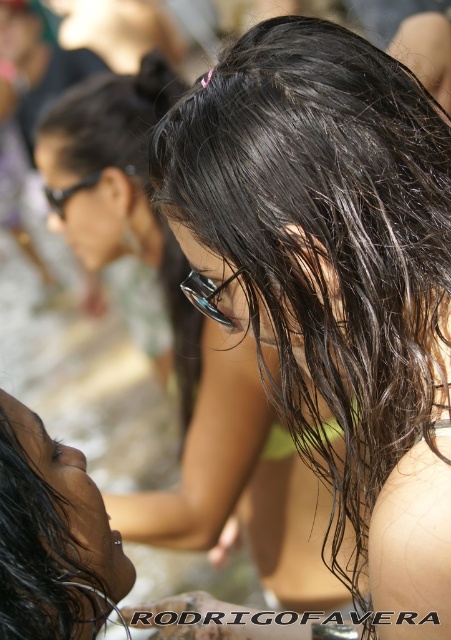
Is clear plastic goggles at center thinner than black plastic glasses at upper left?

Yes, clear plastic goggles at center is thinner than black plastic glasses at upper left.

Can you confirm if clear plastic goggles at center is smaller than black plastic glasses at upper left?

Correct, clear plastic goggles at center occupies less space than black plastic glasses at upper left.

Find the location of a particular element. The width and height of the screenshot is (451, 640). clear plastic goggles at center is located at coordinates (207, 294).

The image size is (451, 640). What are the coordinates of `clear plastic goggles at center` in the screenshot? It's located at (207, 294).

Where is `wet hair at center`? Image resolution: width=451 pixels, height=640 pixels. wet hair at center is located at coordinates (334, 282).

Is wet hair at center taller than black plastic glasses at upper left?

Indeed, wet hair at center has a greater height compared to black plastic glasses at upper left.

This screenshot has width=451, height=640. In order to click on wet hair at center in this screenshot , I will do `click(334, 282)`.

Who is positioned more to the left, clear plastic goggles at center or white matte bikini top at center?

From the viewer's perspective, clear plastic goggles at center appears more on the left side.

Between clear plastic goggles at center and white matte bikini top at center, which one appears on the right side from the viewer's perspective?

white matte bikini top at center is more to the right.

The width and height of the screenshot is (451, 640). What are the coordinates of `clear plastic goggles at center` in the screenshot? It's located at (207, 294).